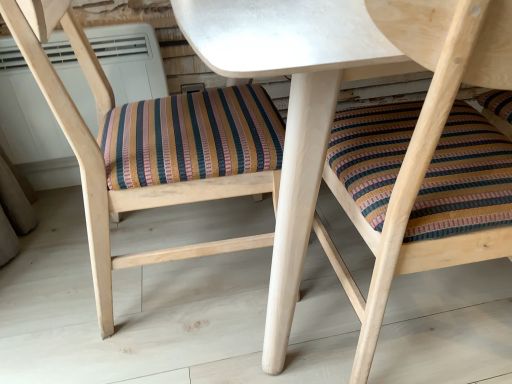
Question: Is white matte table at center not inside multicolored woven cushion at center, the first chair viewed from the left?

Choices:
 (A) yes
 (B) no

Answer: (A)

Question: Could you tell me if white matte table at center is facing multicolored woven cushion at center, the 2th chair from the right?

Choices:
 (A) no
 (B) yes

Answer: (A)

Question: From the image's perspective, would you say white matte table at center is shown under multicolored woven cushion at center, the 2th chair from the right?

Choices:
 (A) yes
 (B) no

Answer: (B)

Question: Can you confirm if white matte table at center is bigger than multicolored woven cushion at center, the first chair viewed from the left?

Choices:
 (A) yes
 (B) no

Answer: (A)

Question: Does white matte table at center contain multicolored woven cushion at center, the first chair viewed from the left?

Choices:
 (A) yes
 (B) no

Answer: (A)

Question: In the image, is white plastic air conditioner at upper center positioned in front of or behind multicolored woven cushion at center, the first chair viewed from the left?

Choices:
 (A) front
 (B) behind

Answer: (B)

Question: From a real-world perspective, is white plastic air conditioner at upper center physically located above or below multicolored woven cushion at center, the 2th chair from the right?

Choices:
 (A) above
 (B) below

Answer: (B)

Question: Is white plastic air conditioner at upper center inside or outside of multicolored woven cushion at center, the first chair viewed from the left?

Choices:
 (A) outside
 (B) inside

Answer: (A)

Question: Does point (9, 89) appear closer or farther from the camera than point (103, 193)?

Choices:
 (A) closer
 (B) farther

Answer: (B)

Question: Is white matte table at center in front of or behind multicolored woven cushion at center, the first chair viewed from the left, in the image?

Choices:
 (A) front
 (B) behind

Answer: (A)

Question: In terms of height, does white matte table at center look taller or shorter compared to multicolored woven cushion at center, the first chair viewed from the left?

Choices:
 (A) short
 (B) tall

Answer: (B)

Question: Is point (278, 331) positioned closer to the camera than point (52, 79)?

Choices:
 (A) farther
 (B) closer

Answer: (A)

Question: Looking at the image, does white matte table at center seem bigger or smaller compared to multicolored woven cushion at center, the first chair viewed from the left?

Choices:
 (A) big
 (B) small

Answer: (A)

Question: Considering the positions of multicolored woven cushion at center, the 2th chair from the right, and white matte table at center in the image, is multicolored woven cushion at center, the 2th chair from the right, wider or thinner than white matte table at center?

Choices:
 (A) wide
 (B) thin

Answer: (B)

Question: From their relative heights in the image, would you say multicolored woven cushion at center, the first chair viewed from the left, is taller or shorter than white matte table at center?

Choices:
 (A) tall
 (B) short

Answer: (B)